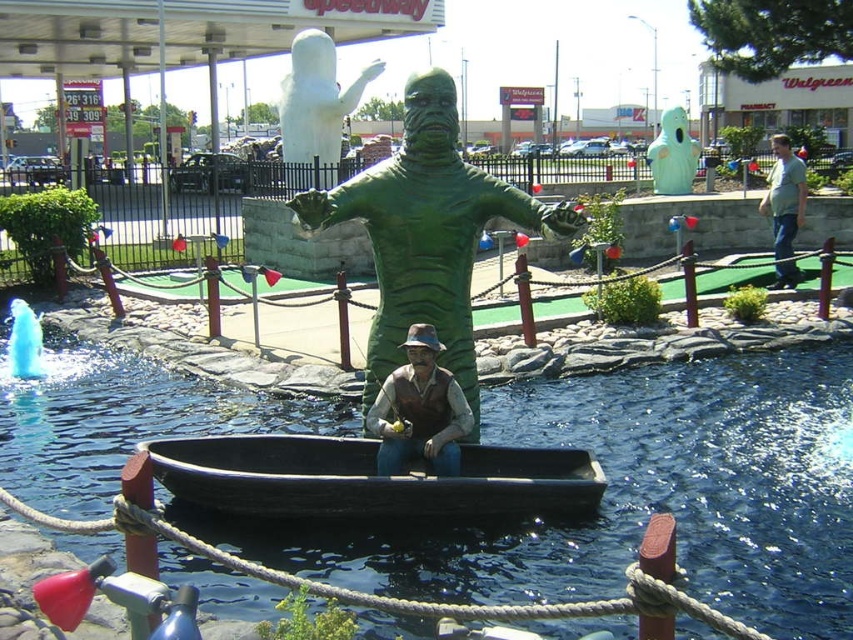
You are a miniature golfer trying to hit the ball into the black wood canoe at center. There is a white matte ghost at upper center nearby. Considering their sizes, which object would require a more precise shot to avoid?

The black wood canoe at center has a smaller size compared to the white matte ghost at upper center, so it would require a more precise shot to avoid.

You are playing miniature golf and need to hit the ball into the hole located at the black wood canoe at center. If your current position is at point A, which is at coordinates 0.600, 0.300, can you directly hit the ball into the hole without any obstacles?

The black wood canoe at center is located at point (370, 480). Since there are no other objects mentioned between your position and the hole, you can directly hit the ball into the hole without any obstacles.